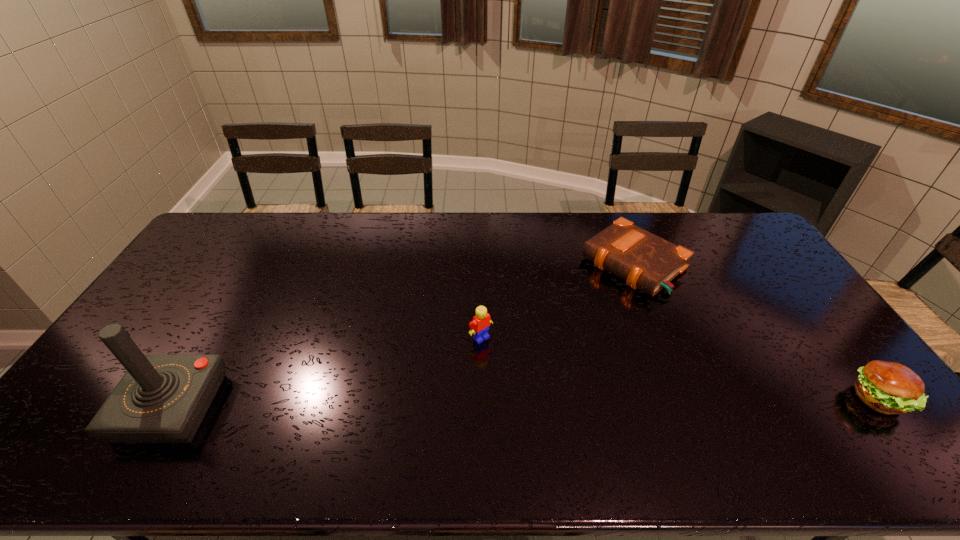
Where is `the leftmost object`? This screenshot has width=960, height=540. the leftmost object is located at coordinates (161, 398).

Locate an element on the screen. the tallest object is located at coordinates [161, 398].

You are a GUI agent. You are given a task and a screenshot of the screen. Output one action in this format:
    pyautogui.click(x=<x>, y=<y>)
    Task: Click on the second shortest object
    This screenshot has width=960, height=540.
    Given the screenshot: What is the action you would take?
    pyautogui.click(x=887, y=387)

Find the location of a particular element. Image resolution: width=960 pixels, height=540 pixels. the rightmost object is located at coordinates (887, 387).

Image resolution: width=960 pixels, height=540 pixels. Identify the location of Lego. (480, 325).

Identify the location of the second object from left to right. The width and height of the screenshot is (960, 540). (480, 325).

I want to click on the shortest object, so click(x=645, y=261).

Locate an element on the screen. The image size is (960, 540). the second object from right to left is located at coordinates (645, 261).

Identify the location of free location located 0.140m on the rectangular base of the leftmost object. The height and width of the screenshot is (540, 960). (74, 407).

Identify the location of vacant space located on the back of the hamburger. This screenshot has width=960, height=540. (844, 354).